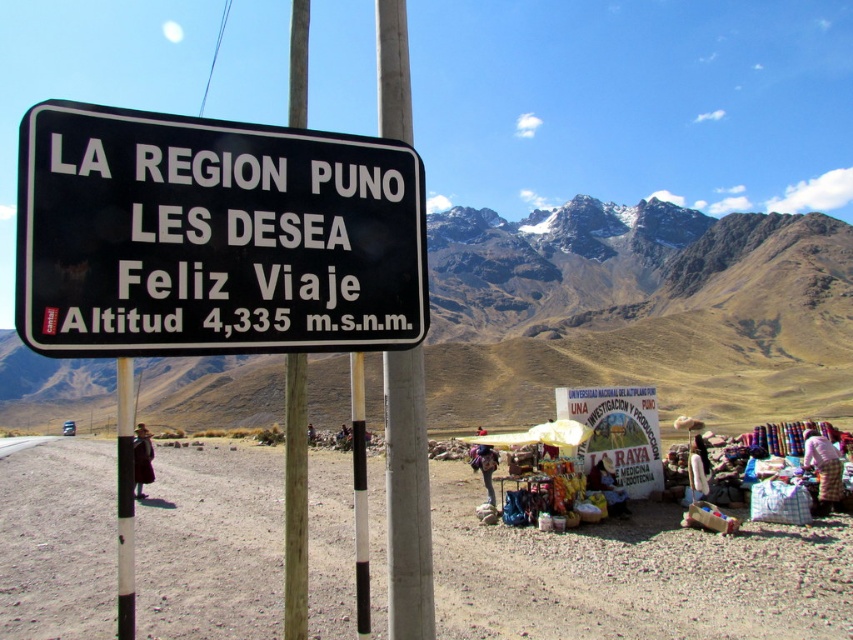
Question: Can you confirm if black plastic sign at center is thinner than white paper sign at center?

Choices:
 (A) yes
 (B) no

Answer: (A)

Question: Based on their relative distances, which object is farther from the black plastic sign at center?

Choices:
 (A) brown rocky mountain at upper center
 (B) metallic pole at center
 (C) white paper sign at center
 (D) white painted metal pole at center

Answer: (A)

Question: Among these objects, which one is nearest to the camera?

Choices:
 (A) white paper sign at center
 (B) brown rocky mountain at upper center
 (C) dusty sand at lower right
 (D) white painted metal pole at center

Answer: (D)

Question: Based on their relative distances, which object is nearer to the dusty sand at lower right?

Choices:
 (A) black plastic sign at center
 (B) brown rocky mountain at upper center
 (C) white painted metal pole at center
 (D) metallic pole at center

Answer: (D)

Question: Is dusty sand at lower right to the right of brown rocky mountain at upper center from the viewer's perspective?

Choices:
 (A) yes
 (B) no

Answer: (A)

Question: Does black plastic sign at center appear under metallic pole at center?

Choices:
 (A) no
 (B) yes

Answer: (A)